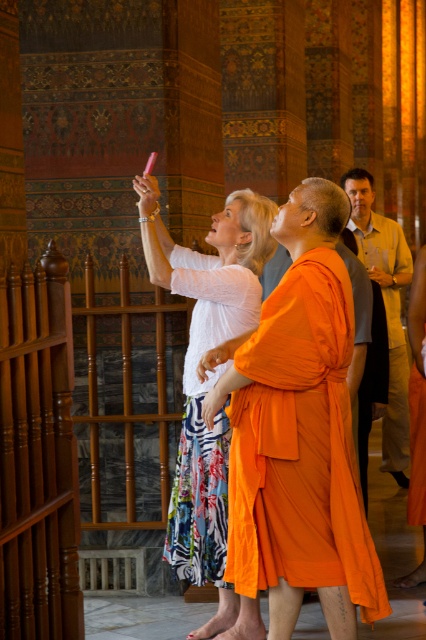
Between orange silk robe at center and white cotton blouse at upper left, which one has less height?

orange silk robe at center is shorter.

Can you confirm if orange silk robe at center is thinner than white cotton blouse at upper left?

Yes.

Who is more distant from viewer, [347,580] or [198,460]?

Positioned behind is point [198,460].

I want to click on orange silk robe at center, so click(299, 445).

Find the location of a particular element. Image resolution: width=426 pixels, height=640 pixels. orange silk robe at center is located at coordinates (299, 445).

Does point (236, 556) come closer to viewer compared to point (391, 385)?

Yes.

Image resolution: width=426 pixels, height=640 pixels. Find the location of `orange silk robe at center`. orange silk robe at center is located at coordinates tap(299, 445).

Can you confirm if white cotton blouse at upper left is shorter than light beige shirt at right?

Correct, white cotton blouse at upper left is not as tall as light beige shirt at right.

Which of these two, white cotton blouse at upper left or light beige shirt at right, stands taller?

With more height is light beige shirt at right.

What do you see at coordinates (212, 371) in the screenshot? This screenshot has height=640, width=426. I see `white cotton blouse at upper left` at bounding box center [212, 371].

Locate an element on the screen. The height and width of the screenshot is (640, 426). white cotton blouse at upper left is located at coordinates (212, 371).